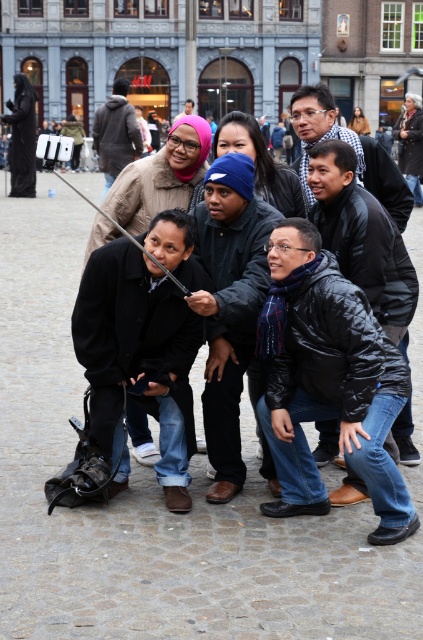
Question: Which object is closer to the camera taking this photo?

Choices:
 (A) metallic silver pole at center
 (B) black quilted jacket at center
 (C) matte black jacket at upper center
 (D) light brown leather jacket at center

Answer: (B)

Question: Which point is farther to the camera?

Choices:
 (A) (120, 81)
 (B) (148, 253)
 (C) (310, 132)

Answer: (A)

Question: Is the position of matte black jacket at upper center less distant than that of light brown leather jacket at center?

Choices:
 (A) no
 (B) yes

Answer: (B)

Question: Is black quilted jacket at center above matte black jacket at upper center?

Choices:
 (A) yes
 (B) no

Answer: (B)

Question: Can you confirm if black quilted jacket at center is positioned above metallic silver pole at center?

Choices:
 (A) no
 (B) yes

Answer: (A)

Question: Which is farther from the blue knit cap at center?

Choices:
 (A) matte black jacket at upper center
 (B) metallic silver pole at center
 (C) light brown leather jacket at center

Answer: (C)